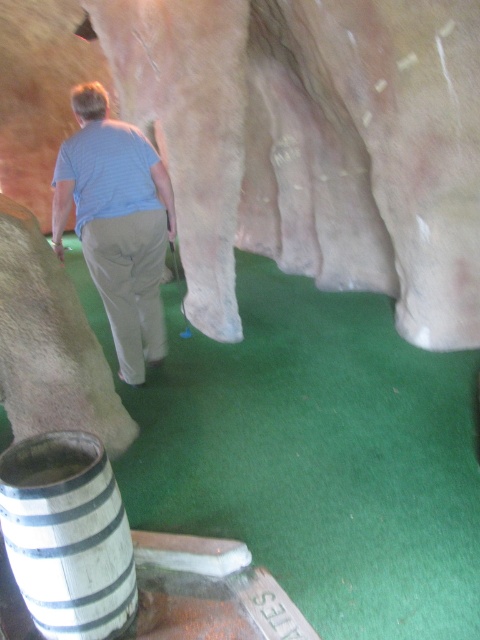
Is smooth beige rock at center further to the viewer compared to wooden barrel at lower left?

Yes, it is.

Is point (298, 52) positioned in front of point (26, 586)?

No, (298, 52) is further to viewer.

This screenshot has height=640, width=480. Identify the location of smooth beige rock at center. (314, 145).

Who is higher up, smooth beige rock at center or green artificial turf at center?

smooth beige rock at center

Does smooth beige rock at center have a greater width compared to green artificial turf at center?

No, smooth beige rock at center is not wider than green artificial turf at center.

At what (x,y) coordinates should I click in order to perform the action: click on smooth beige rock at center. Please return your answer as a coordinate pair (x, y). This screenshot has height=640, width=480. Looking at the image, I should click on (314, 145).

Is green artificial turf at center shorter than light blue striped shirt at center?

Yes, green artificial turf at center is shorter than light blue striped shirt at center.

Is green artificial turf at center wider than light blue striped shirt at center?

Yes, green artificial turf at center is wider than light blue striped shirt at center.

Describe the element at coordinates (314, 452) in the screenshot. The height and width of the screenshot is (640, 480). I see `green artificial turf at center` at that location.

This screenshot has height=640, width=480. What are the coordinates of `green artificial turf at center` in the screenshot? It's located at (314, 452).